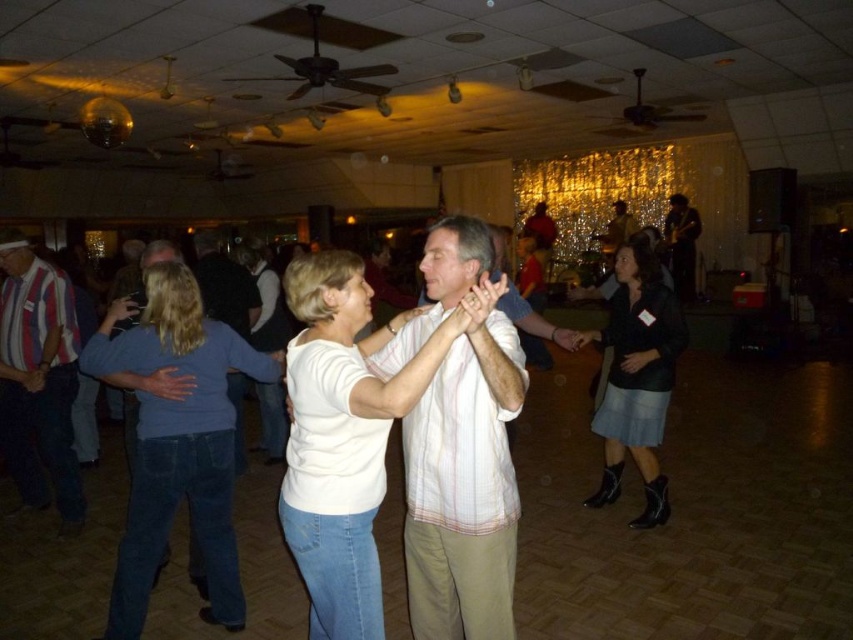
Question: Which of the following is the farthest from the observer?

Choices:
 (A) (236, 285)
 (B) (685, 268)

Answer: (B)

Question: Is white matte shirt at center to the right of striped cotton shirt at left from the viewer's perspective?

Choices:
 (A) no
 (B) yes

Answer: (B)

Question: Which point is closer to the camera taking this photo?

Choices:
 (A) (676, 276)
 (B) (625, 353)
 (C) (228, 289)
 (D) (370, 403)

Answer: (D)

Question: Where is denim skirt at lower right located in relation to white cotton shirt at center in the image?

Choices:
 (A) left
 (B) right

Answer: (B)

Question: Does denim jeans at center come behind white cotton shirt at center?

Choices:
 (A) yes
 (B) no

Answer: (B)

Question: Which object appears closest to the camera in this image?

Choices:
 (A) denim jeans at center
 (B) denim skirt at lower right
 (C) dark brown leather jacket at upper right

Answer: (A)